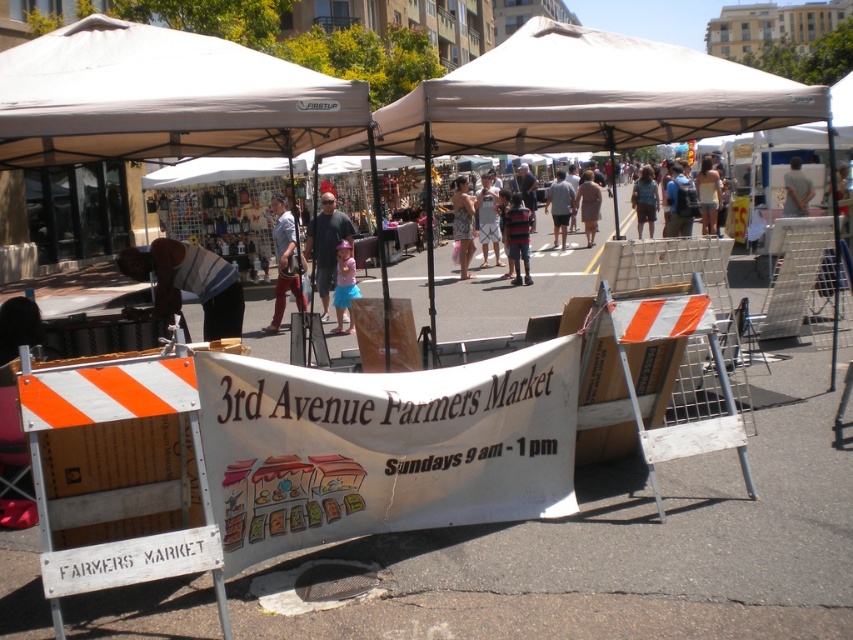
Is striped fabric at center bigger than pink fabric skirt at center?

Incorrect, striped fabric at center is not larger than pink fabric skirt at center.

Which of these two, striped fabric at center or pink fabric skirt at center, stands shorter?

striped fabric at center

Who is more forward, (x=241, y=314) or (x=347, y=328)?

Point (x=241, y=314) is more forward.

This screenshot has height=640, width=853. I want to click on striped fabric at center, so click(x=186, y=284).

Between striped shirt at center and light brown fabric dress at center, which one is positioned higher?

Positioned higher is light brown fabric dress at center.

Can you confirm if striped shirt at center is wider than light brown fabric dress at center?

Yes, striped shirt at center is wider than light brown fabric dress at center.

Between point (511, 250) and point (592, 225), which one is positioned in front?

Point (511, 250)

Image resolution: width=853 pixels, height=640 pixels. What are the coordinates of `striped shirt at center` in the screenshot? It's located at (517, 237).

What do you see at coordinates (796, 189) in the screenshot? The image size is (853, 640). I see `white fabric shirt at upper right` at bounding box center [796, 189].

This screenshot has width=853, height=640. In order to click on white fabric shirt at upper right in this screenshot , I will do `click(796, 189)`.

Which is in front, point (788, 198) or point (590, 228)?

Positioned in front is point (788, 198).

Image resolution: width=853 pixels, height=640 pixels. Identify the location of white fabric shirt at upper right. (796, 189).